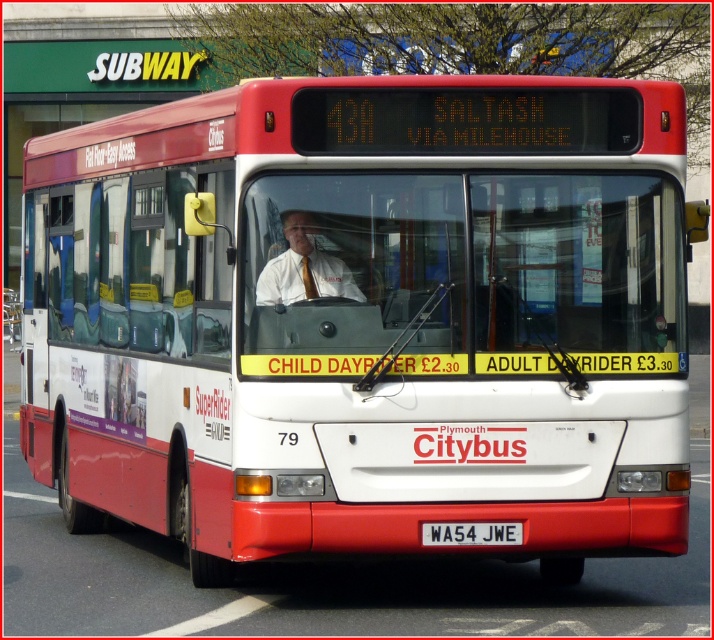
You are a passenger standing at the back of the bus and want to see both the matte white shirt at center and the white plastic license plate at center. Can you see both objects at the same time without moving your head?

The matte white shirt at center and white plastic license plate at center are 4.84 feet apart, so yes, you can see both objects at the same time without moving your head since they are within a typical viewing angle for a passenger at the back of the bus.

You are a passenger on the bus and want to see the driver wearing the matte white shirt at center. However, the white plastic license plate at center is blocking your view. Can you see the driver through the license plate?

The white plastic license plate at center is behind the matte white shirt at center, so you can see the driver wearing the matte white shirt at center because the license plate is not in front of them.